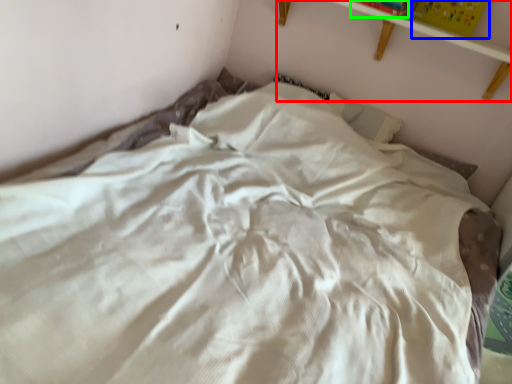
Question: Based on their relative distances, which object is nearer to shelf (highlighted by a red box)? Choose from paperback book (highlighted by a blue box) and paperback book (highlighted by a green box).

Choices:
 (A) paperback book
 (B) paperback book

Answer: (A)